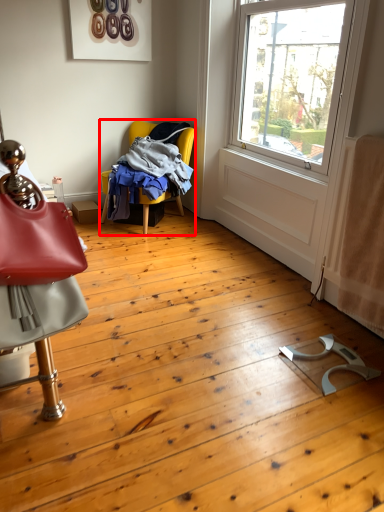
Question: Considering the relative positions of chair (annotated by the red box) and chair in the image provided, where is chair (annotated by the red box) located with respect to the staircase?

Choices:
 (A) right
 (B) left

Answer: (A)